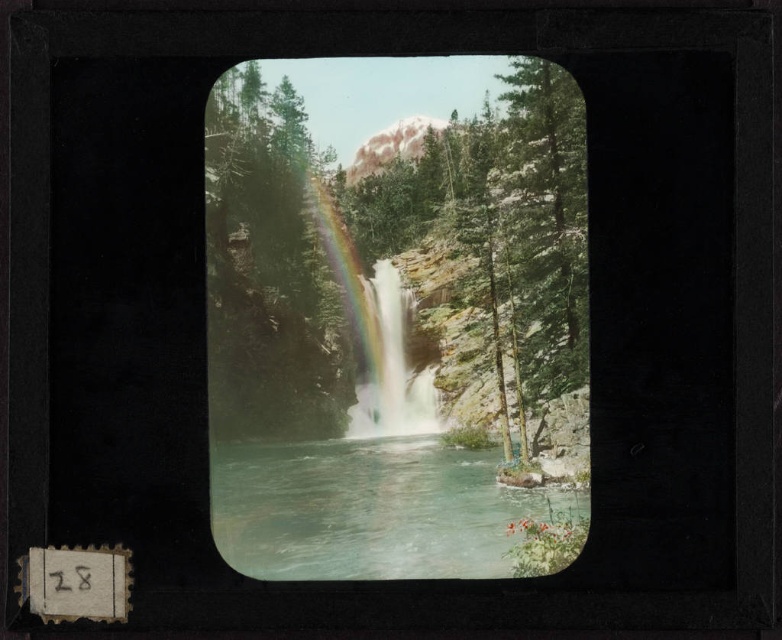
You are standing at the point marked by point [393,240] in the image. What is the closest object to you in this natural scene?

The closest object to you at point [393,240] is the green textured tree at center, as the point marks its location.

You are standing at the center of the image and want to locate the green textured tree at center. Which direction should you look to find it?

The green textured tree at center is already at the center of the image, so you should look straight ahead to find it.